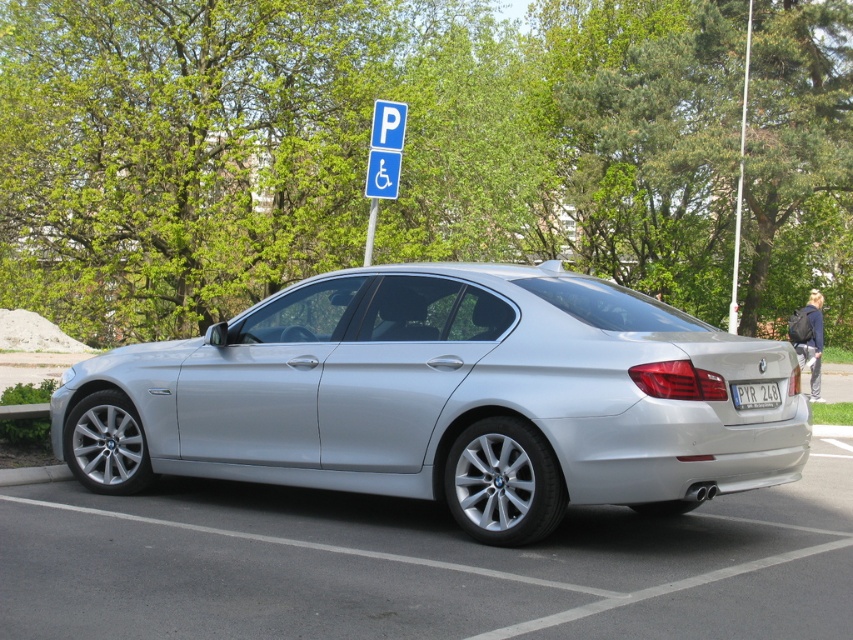
Question: From the image, what is the correct spatial relationship of satin silver car at center in relation to silver metallic car at center?

Choices:
 (A) left
 (B) right

Answer: (A)

Question: Does silver metallic car at center appear over white plastic license plate at rear?

Choices:
 (A) no
 (B) yes

Answer: (A)

Question: Which object appears closest to the camera in this image?

Choices:
 (A) white plastic license plate at rear
 (B) silver metallic car at center

Answer: (B)

Question: Which of the following is the closest to the observer?

Choices:
 (A) (70, 522)
 (B) (543, 362)
 (C) (741, 394)

Answer: (C)

Question: Is satin silver car at center to the right of silver metallic car at center from the viewer's perspective?

Choices:
 (A) yes
 (B) no

Answer: (B)

Question: Which of these objects is positioned closest to the silver metallic car at center?

Choices:
 (A) satin silver car at center
 (B) white plastic license plate at rear

Answer: (A)